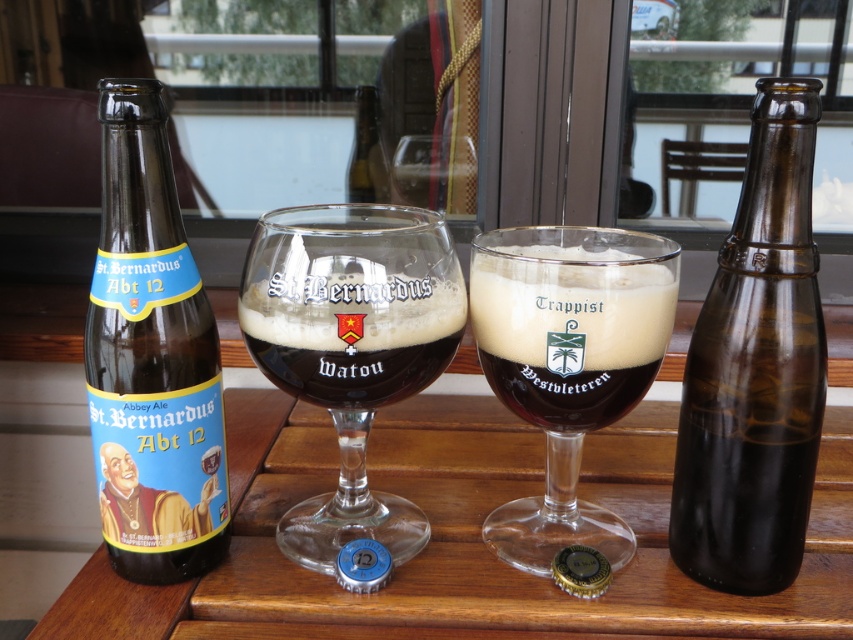
Does matte glass beer at center have a greater width compared to brown glass bottle at center?

Indeed, matte glass beer at center has a greater width compared to brown glass bottle at center.

Locate an element on the screen. The image size is (853, 640). matte glass beer at center is located at coordinates (567, 364).

Describe the element at coordinates (567, 364) in the screenshot. I see `matte glass beer at center` at that location.

This screenshot has width=853, height=640. I want to click on matte glass beer at center, so click(567, 364).

Does clear glass beer glass at center have a larger size compared to dark brown glass at center?

Yes.

Locate an element on the screen. Image resolution: width=853 pixels, height=640 pixels. clear glass beer glass at center is located at coordinates (351, 348).

I want to click on clear glass beer glass at center, so click(x=351, y=348).

Between matte glass beer at center and brown glass bottle at left, which one appears on the right side from the viewer's perspective?

From the viewer's perspective, matte glass beer at center appears more on the right side.

Measure the distance between point (495,392) and camera.

Point (495,392) is 22.66 inches from camera.

What do you see at coordinates (567, 364) in the screenshot? This screenshot has height=640, width=853. I see `matte glass beer at center` at bounding box center [567, 364].

Find the location of a particular element. matte glass beer at center is located at coordinates (567, 364).